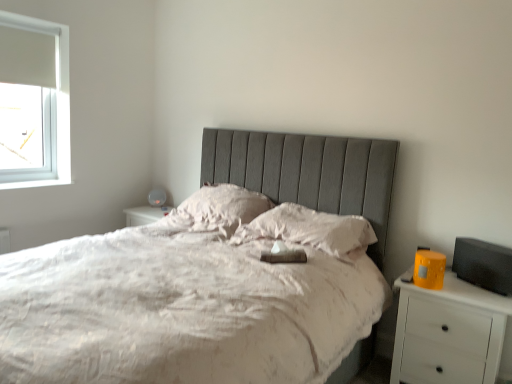
Question: Is white matte nightstand at right far from silky white pillow at center, placed as the 2th pillow when sorted from left to right?

Choices:
 (A) no
 (B) yes

Answer: (A)

Question: Can you confirm if white matte nightstand at right is shorter than silky white pillow at center, which appears as the 1th pillow when viewed from the right?

Choices:
 (A) yes
 (B) no

Answer: (B)

Question: From the image's perspective, does white matte nightstand at right appear lower than silky white pillow at center, which appears as the 1th pillow when viewed from the right?

Choices:
 (A) no
 (B) yes

Answer: (B)

Question: Does white matte nightstand at right turn towards silky white pillow at center, placed as the 2th pillow when sorted from left to right?

Choices:
 (A) no
 (B) yes

Answer: (A)

Question: Does white matte nightstand at right have a greater width compared to silky white pillow at center, placed as the 2th pillow when sorted from left to right?

Choices:
 (A) yes
 (B) no

Answer: (B)

Question: In the image, is matte gray table lamp at upper center positioned in front of or behind silky white pillow at center, placed as the 2th pillow when sorted from left to right?

Choices:
 (A) behind
 (B) front

Answer: (A)

Question: Is point (158, 196) closer or farther from the camera than point (295, 230)?

Choices:
 (A) farther
 (B) closer

Answer: (A)

Question: Considering the positions of matte gray table lamp at upper center and silky white pillow at center, which appears as the 1th pillow when viewed from the right, in the image, is matte gray table lamp at upper center wider or thinner than silky white pillow at center, which appears as the 1th pillow when viewed from the right,?

Choices:
 (A) wide
 (B) thin

Answer: (B)

Question: In the image, is matte gray table lamp at upper center on the left side or the right side of silky white pillow at center, which appears as the 1th pillow when viewed from the right?

Choices:
 (A) left
 (B) right

Answer: (A)

Question: From the image's perspective, is white soft pillow at center, which ranks as the 1th pillow in left-to-right order, positioned above or below white matte nightstand at right?

Choices:
 (A) above
 (B) below

Answer: (A)

Question: Which is correct: white soft pillow at center, acting as the 2th pillow starting from the right, is inside white matte nightstand at right, or outside of it?

Choices:
 (A) inside
 (B) outside

Answer: (B)

Question: Is white soft pillow at center, acting as the 2th pillow starting from the right, taller or shorter than white matte nightstand at right?

Choices:
 (A) tall
 (B) short

Answer: (B)

Question: Visually, is white soft pillow at center, acting as the 2th pillow starting from the right, positioned to the left or to the right of white matte nightstand at right?

Choices:
 (A) right
 (B) left

Answer: (B)

Question: Considering the positions of silky white pillow at center, which appears as the 1th pillow when viewed from the right, and white matte nightstand at right in the image, is silky white pillow at center, which appears as the 1th pillow when viewed from the right, wider or thinner than white matte nightstand at right?

Choices:
 (A) thin
 (B) wide

Answer: (B)

Question: Is silky white pillow at center, which appears as the 1th pillow when viewed from the right, situated inside white matte nightstand at right or outside?

Choices:
 (A) inside
 (B) outside

Answer: (B)